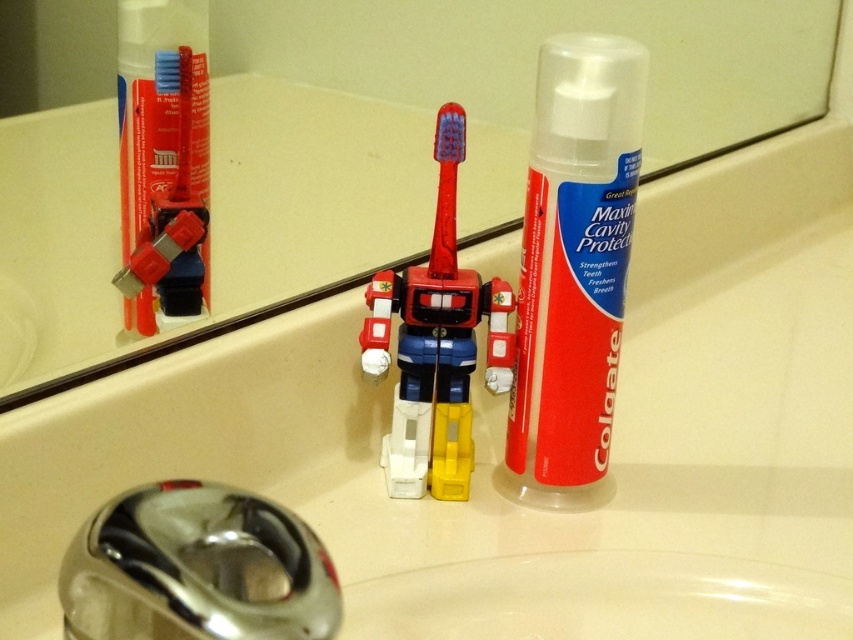
Question: Is matte plastic toothbrush at upper center closer to the viewer compared to red plastic toothbrush at center?

Choices:
 (A) yes
 (B) no

Answer: (B)

Question: Is red matte toothpaste at center closer to the viewer compared to red plastic toothbrush at center?

Choices:
 (A) no
 (B) yes

Answer: (B)

Question: Which point is closer to the camera?

Choices:
 (A) matte plastic toothbrush at upper center
 (B) chrome metallic faucet at lower left
 (C) red matte toothpaste at center
 (D) red plastic toothbrush at center

Answer: (B)

Question: Which point is farther from the camera taking this photo?

Choices:
 (A) (469, 310)
 (B) (583, 477)
 (C) (184, 205)

Answer: (B)

Question: Can you confirm if red matte toothpaste at center is positioned above red plastic toothbrush at center?

Choices:
 (A) no
 (B) yes

Answer: (B)

Question: Which point is closer to the camera?

Choices:
 (A) (141, 148)
 (B) (437, 205)
 (C) (254, 625)
 (D) (553, 400)

Answer: (C)